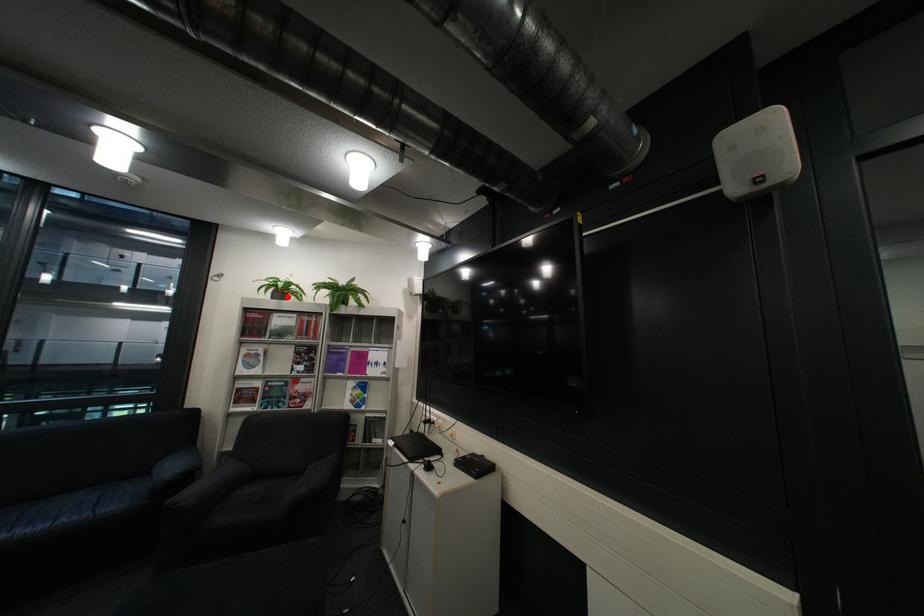
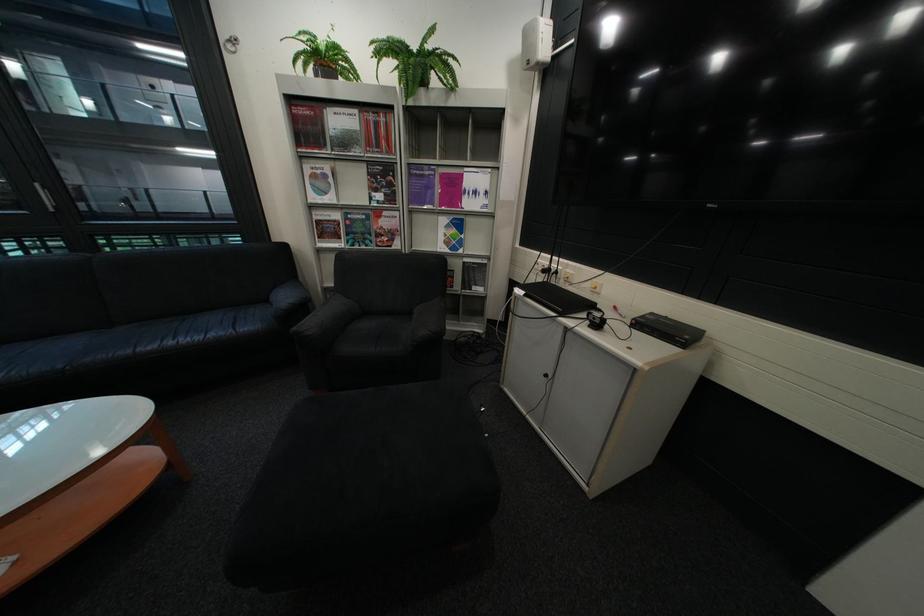
Where in the second image is the point corresponding to the highlighted location from the first image?

(333, 78)